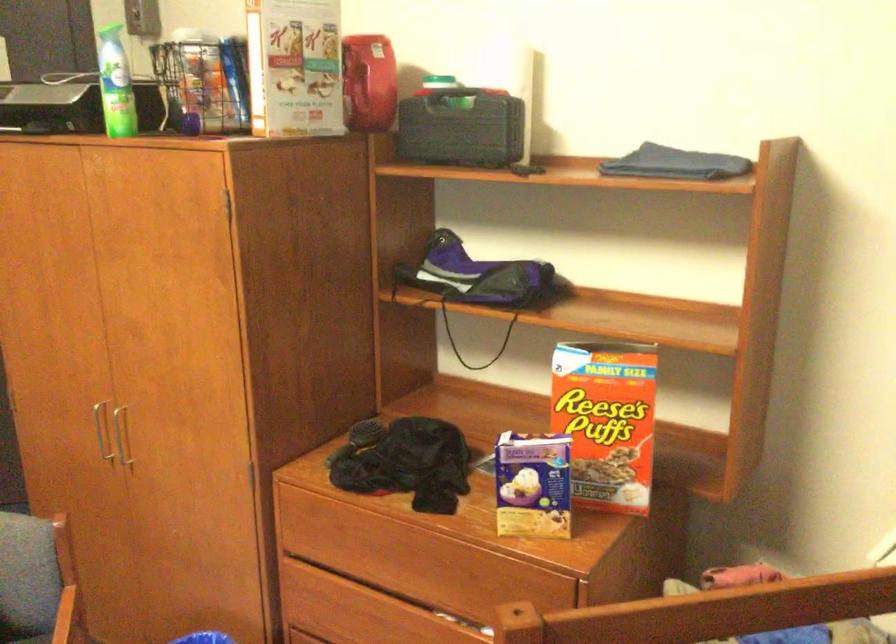
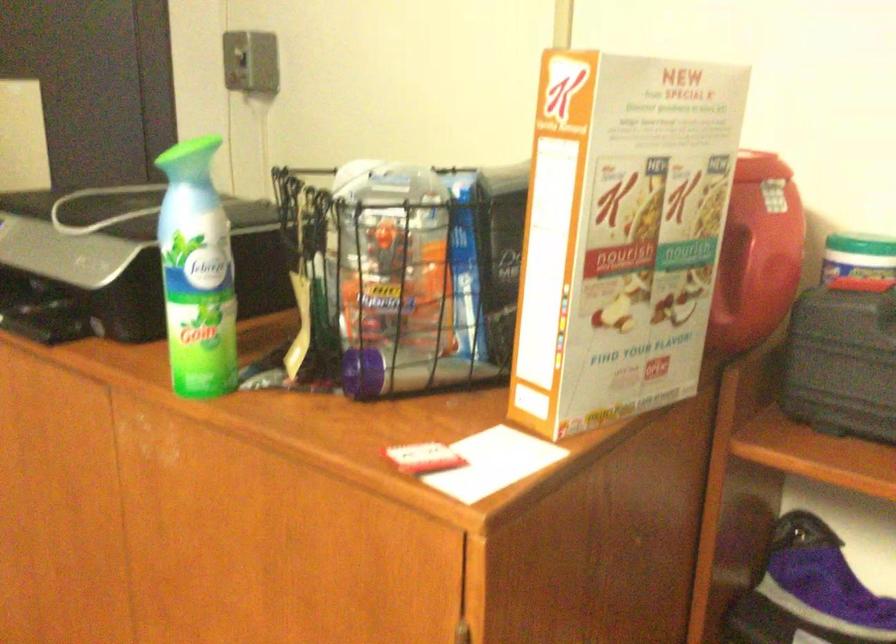
Locate, in the second image, the point that corresponds to point (202, 79) in the first image.

(401, 275)